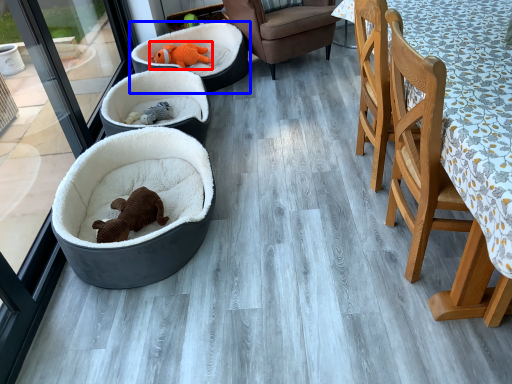
Question: Which of the following is the farthest to the observer, animal (highlighted by a red box) or dog bed (highlighted by a blue box)?

Choices:
 (A) animal
 (B) dog bed

Answer: (A)